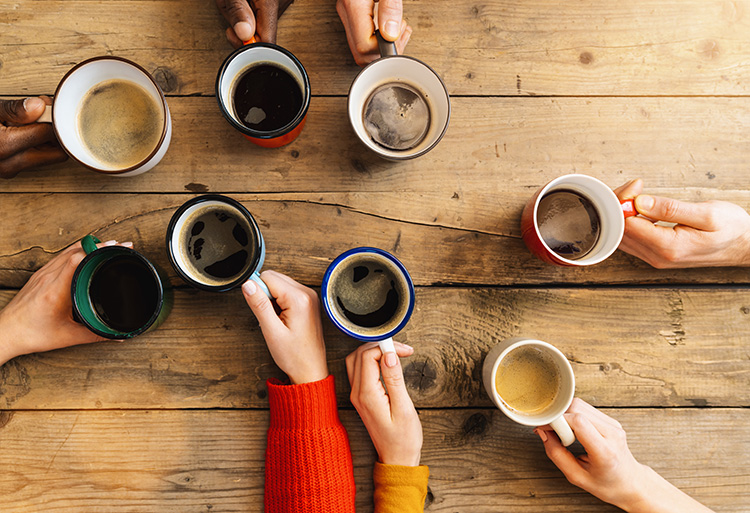
The width and height of the screenshot is (750, 513). Identify the location of rims of the mugs. (99, 55), (236, 54), (424, 64), (538, 205), (516, 345), (412, 297), (256, 229), (162, 313).